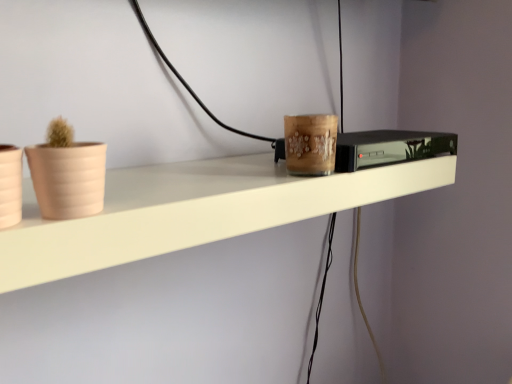
This screenshot has width=512, height=384. I want to click on vacant space behind beige matte flowerpot at left, the first flowerpot when ordered from right to left, so click(x=176, y=174).